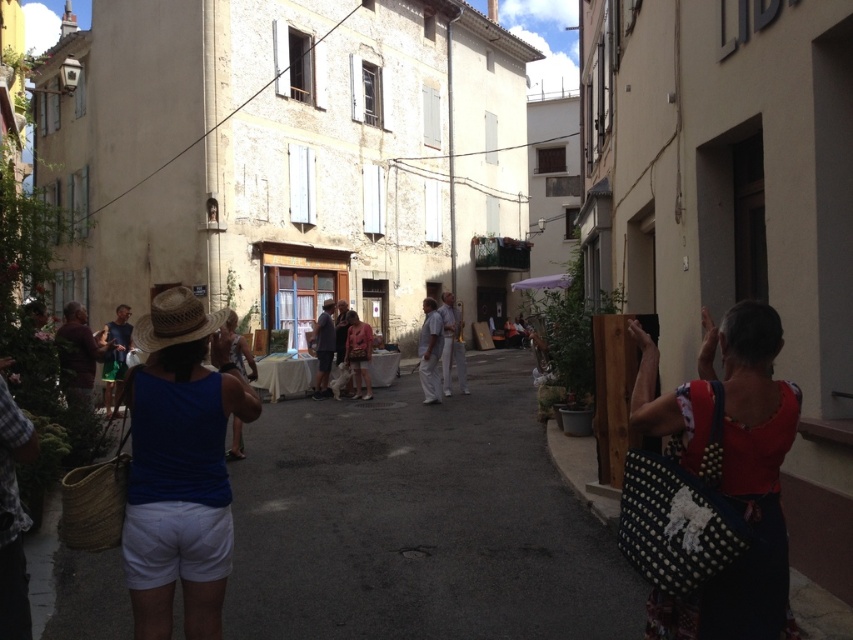
Question: Estimate the real-world distances between objects in this image. Which object is farther from the white cotton shirt at center?

Choices:
 (A) pink fabric dress at center
 (B) denim shorts at center
 (C) dark blue shirt at center
 (D) white cotton pants at center

Answer: (B)

Question: Which of the following is the closest to the observer?

Choices:
 (A) white cotton shirt at center
 (B) white cotton pants at center
 (C) blue denim shorts at left

Answer: (C)

Question: Can you confirm if strawmaterial/texturehat at center is positioned to the left of white cotton pants at center?

Choices:
 (A) no
 (B) yes

Answer: (B)

Question: Is blue denim shorts at left closer to the viewer compared to dark blue shirt at center?

Choices:
 (A) no
 (B) yes

Answer: (B)

Question: Which of the following is the farthest from the observer?

Choices:
 (A) dark blue shirt at center
 (B) white cotton pants at center

Answer: (A)

Question: Observing the image, what is the correct spatial positioning of denim shorts at center in reference to pink fabric dress at center?

Choices:
 (A) above
 (B) below

Answer: (A)